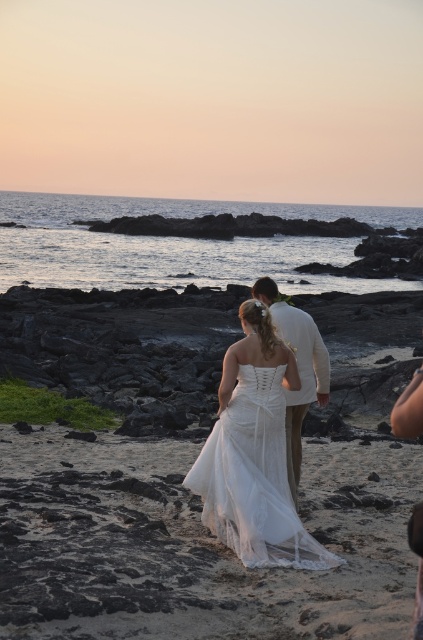
Consider the image. You are a photographer capturing the wedding couple on the beach. You need to position yourself at point A, which is at coordinates point (354, 531), and point B, which is at coordinates point (299, 401). Which point should you choose to ensure the couple is fully visible without any obstructions?

You should choose point A at coordinates point (354, 531) because it is in front of point B at coordinates point (299, 401), providing a clearer view of the couple without obstructions.

You are a photographer at the beach scene. You need to capture a photo where both the white lace dress at center and the white satin dress at center are in focus. The camera you are using has a depth of field that can cover 40 inches. Will both dresses be in focus in the photo?

The white lace dress at center and the white satin dress at center are 38.87 inches apart. Since the camera has a depth of field of 40 inches, which is greater than the distance between them, both dresses will be in focus in the photo.